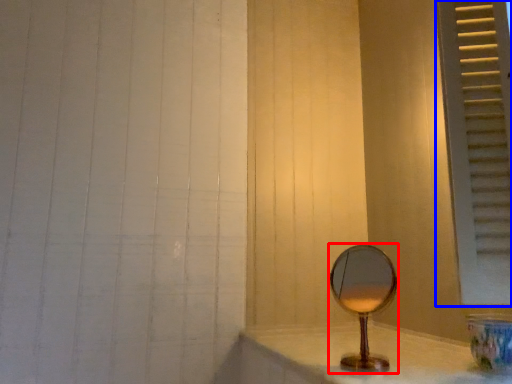
Question: Which object is further to the camera taking this photo, mirror (highlighted by a red box) or window frame (highlighted by a blue box)?

Choices:
 (A) mirror
 (B) window frame

Answer: (A)